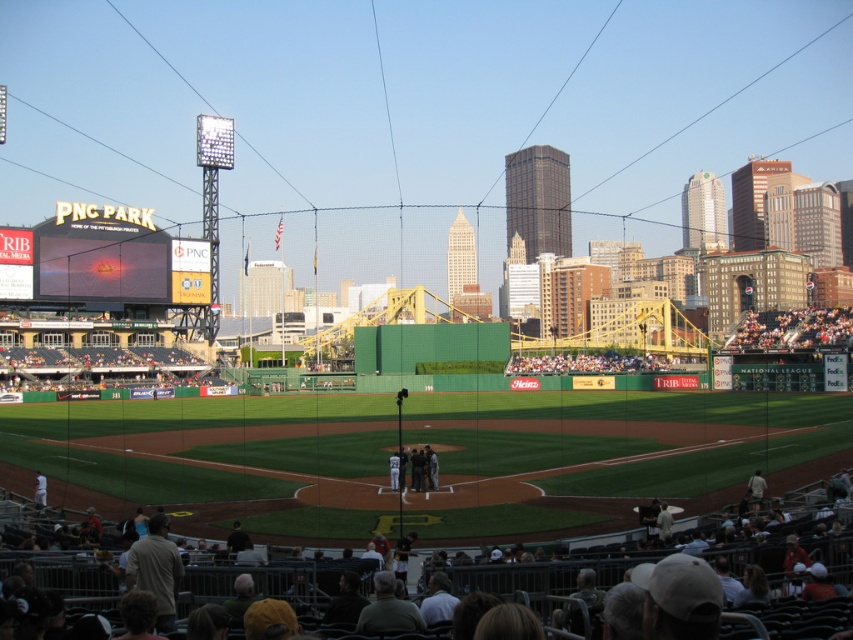
Question: Is dark brown leather seats at lower center in front of matte black scoreboard at upper left?

Choices:
 (A) yes
 (B) no

Answer: (A)

Question: Which point is closer to the camera?

Choices:
 (A) dark brown wooden bench at upper right
 (B) matte black scoreboard at upper left

Answer: (B)

Question: Can you confirm if dark brown leather seats at lower center is bigger than matte black scoreboard at upper left?

Choices:
 (A) yes
 (B) no

Answer: (B)

Question: Among these points, which one is farthest from the camera?

Choices:
 (A) (161, 259)
 (B) (428, 456)

Answer: (A)

Question: Is dark brown leather seats at lower center to the right of dark brown wooden bench at upper right from the viewer's perspective?

Choices:
 (A) yes
 (B) no

Answer: (B)

Question: Which point is farther from the camera taking this photo?

Choices:
 (A) (1, 572)
 (B) (757, 326)
 (C) (97, 253)
 (D) (415, 458)

Answer: (B)